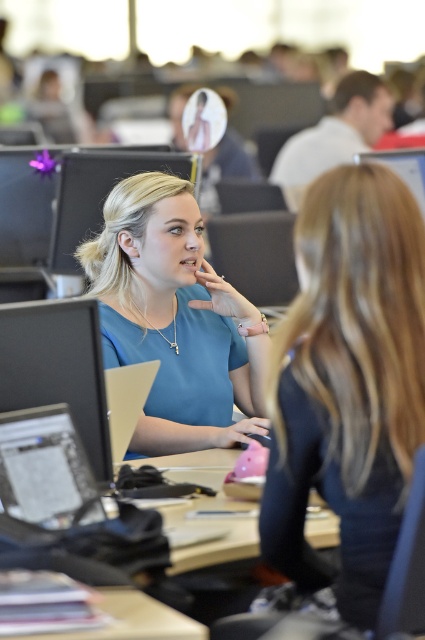
You are a photographer setting up for a group photo in the classroom. You need to arrange the two people so that their shirts are visible. The black matte shirt at center and the blue fabric shirt at center must be placed in a way that their shirts are clearly visible. Given their current positions, which shirt is on the right side when facing the camera?

The black matte shirt at center is positioned on the right side of the blue fabric shirt at center, so when facing the camera, the black matte shirt at center is on the right side.

Based on the photo, you are an observer standing in front of the two people at the center of the scene. You notice both the black matte shirt at center and the blue fabric shirt at center. Which shirt is positioned lower on the person?

The black matte shirt at center is located below the blue fabric shirt at center, so the black matte shirt at center is positioned lower on the person.

You are a photographer setting up a shot of the two people in the classroom. The blue fabric shirt at center and the matte black monitor at left are both in your frame. Which object should you adjust your focus to ensure the larger one is in sharp detail?

The blue fabric shirt at center is larger in size than the matte black monitor at left, so you should adjust your focus on the blue fabric shirt at center to ensure it is in sharp detail.